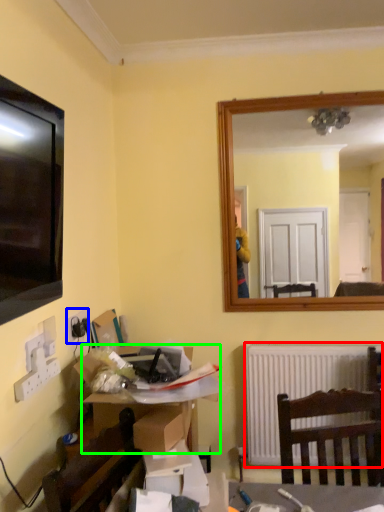
Question: Which is farther away from radiator (highlighted by a red box)? electric outlet (highlighted by a blue box) or desk (highlighted by a green box)?

Choices:
 (A) electric outlet
 (B) desk

Answer: (A)